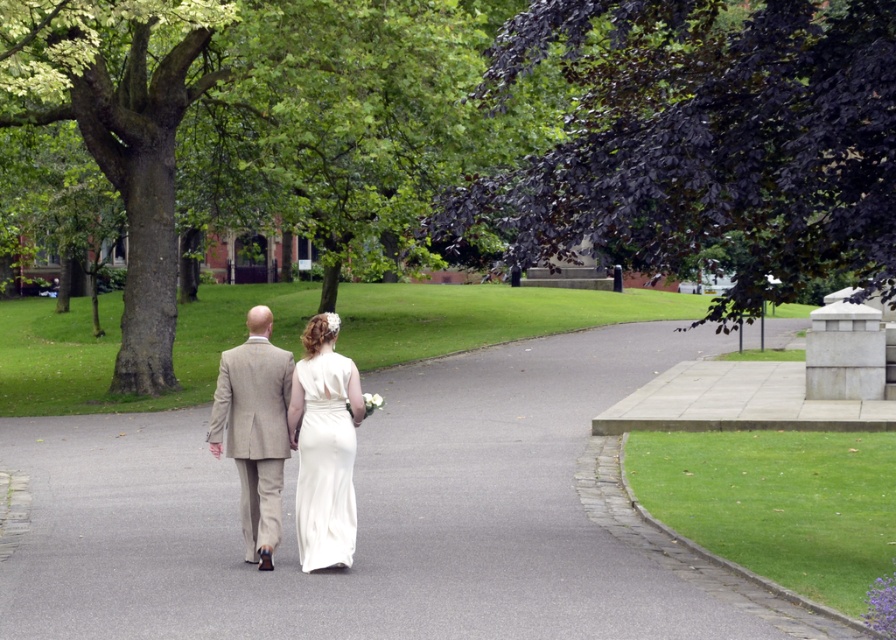
You are a photographer planning to take a portrait of the couple in the scene. You want to ensure both the light beige suit at center and the white satin dress at center are clearly visible in the frame. Given their sizes, which clothing item might require more careful framing to avoid being overshadowed?

The white satin dress at center is smaller in size than the light beige suit at center, so it might require more careful framing to ensure it remains visible and not overshadowed by the larger light beige suit at center.

You are a photographer positioned at the edge of the pathway. You want to capture a photo of the white satin dress at center and the green leafy tree at center. In the final photo, which object will appear on the right side of the frame?

The green leafy tree at center will appear on the right side of the frame because it is positioned to the right of the white satin dress at center.

Based on the photo, you are a photographer positioned at the start of the pathway. You want to capture a photo where the light beige suit at center is on the left side of the white satin dress at center. Does the current arrangement allow this?

Yes, the light beige suit at center is already positioned to the left of the white satin dress at center, so the current arrangement allows the light beige suit at center to be on the left side of the white satin dress at center in the photo.